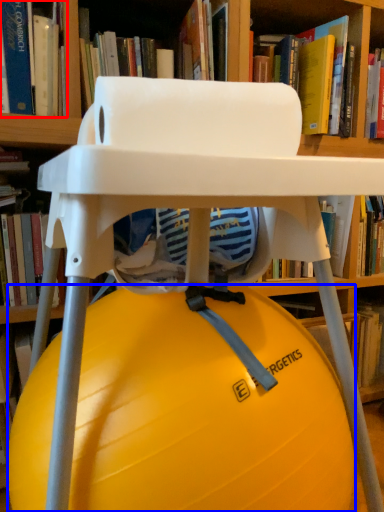
Question: Which object is closer to the camera taking this photo, book (highlighted by a red box) or ball (highlighted by a blue box)?

Choices:
 (A) book
 (B) ball

Answer: (B)